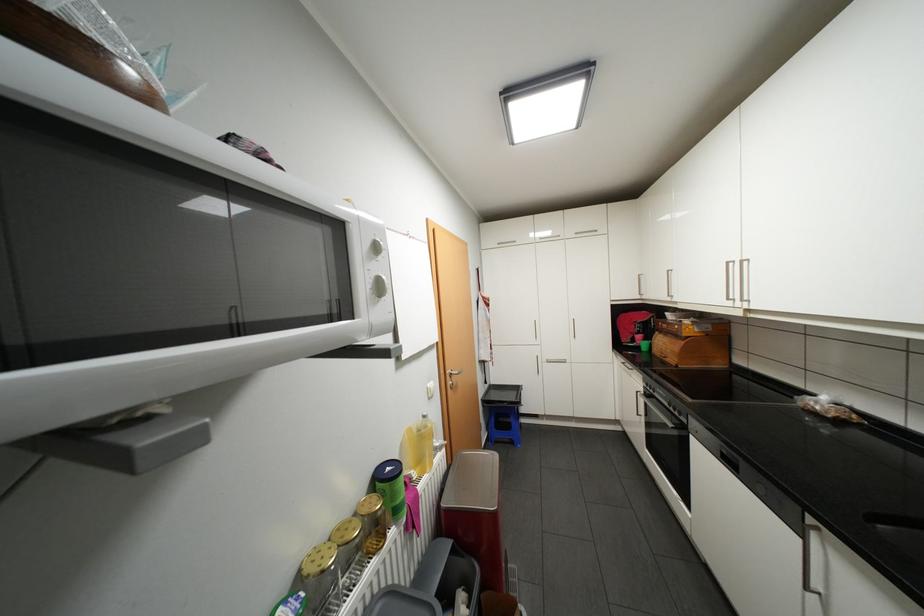
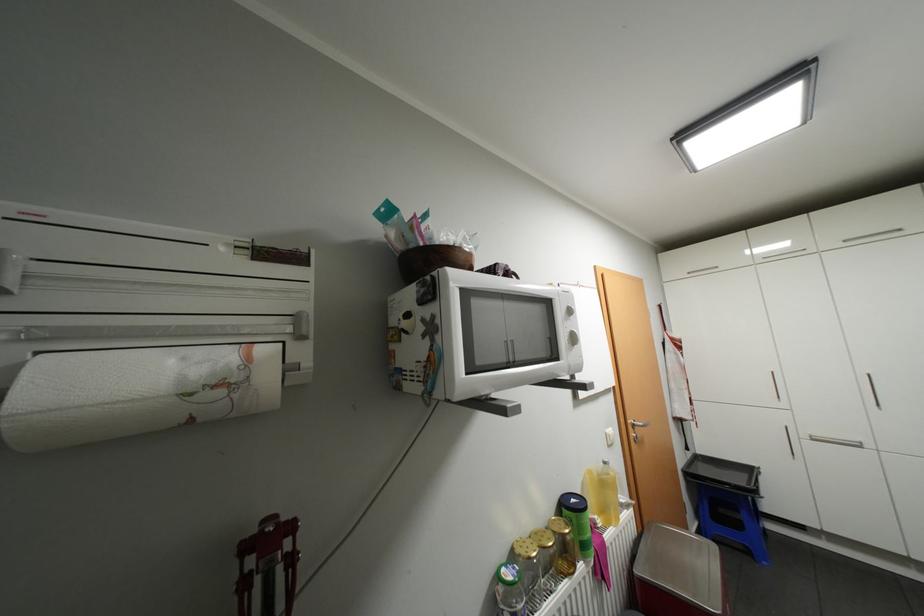
The point at (x=395, y=468) is marked in the first image. Where is the corresponding point in the second image?

(580, 499)